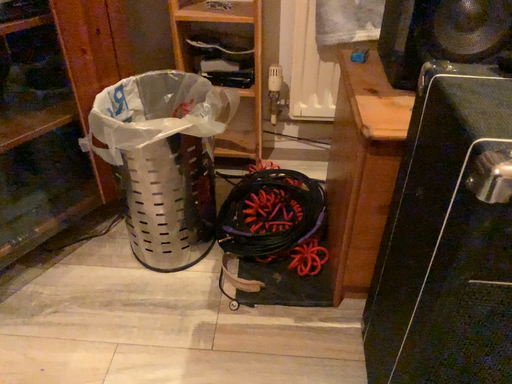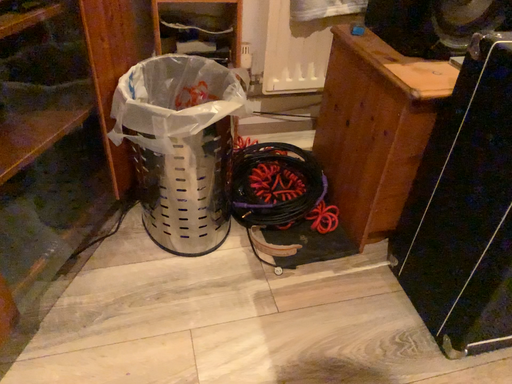
Question: Which way did the camera rotate in the video?

Choices:
 (A) rotated left
 (B) rotated right

Answer: (B)